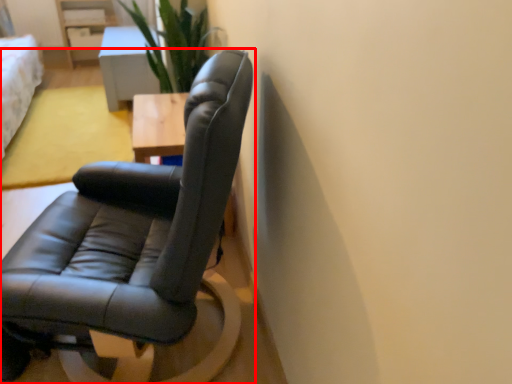
Question: Observing the image, what is the correct spatial positioning of chair (annotated by the red box) in reference to table?

Choices:
 (A) left
 (B) right

Answer: (B)